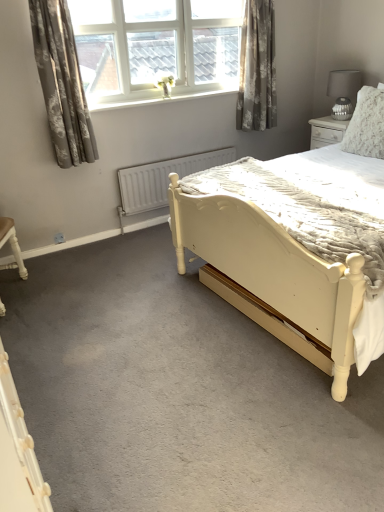
Describe the element at coordinates (156, 46) in the screenshot. I see `white plastic window at upper center` at that location.

Measure the distance between white plastic window at upper center and camera.

white plastic window at upper center and camera are 2.94 meters apart.

Looking at this image, measure the distance between point (235, 90) and camera.

The depth of point (235, 90) is 12.05 feet.

This screenshot has width=384, height=512. What do you see at coordinates (343, 92) in the screenshot?
I see `matte gray lampshade at upper right` at bounding box center [343, 92].

This screenshot has width=384, height=512. Identify the location of matte cream wooden bed at center. (295, 248).

Is matte gray lampshade at upper right thinner than matte cream wooden bed at center?

Indeed, matte gray lampshade at upper right has a lesser width compared to matte cream wooden bed at center.

The width and height of the screenshot is (384, 512). In the image, there is a matte cream wooden bed at center. Identify the location of lamp above it (from the image's perspective). (343, 92).

Which object is positioned more to the right, matte gray lampshade at upper right or matte cream wooden bed at center?

matte gray lampshade at upper right.

From the image's perspective, is matte gray lampshade at upper right below matte cream wooden bed at center?

No.

Can you tell me how much matte gray lampshade at upper right and white glossy window sill at upper center differ in facing direction?

90 degrees.

Considering the sizes of matte gray lampshade at upper right and white glossy window sill at upper center in the image, is matte gray lampshade at upper right taller or shorter than white glossy window sill at upper center?

Clearly, matte gray lampshade at upper right is taller compared to white glossy window sill at upper center.

Does matte gray lampshade at upper right have a lesser width compared to white glossy window sill at upper center?

Incorrect, the width of matte gray lampshade at upper right is not less than that of white glossy window sill at upper center.

The height and width of the screenshot is (512, 384). I want to click on window sill lying in front of the matte gray lampshade at upper right, so click(x=161, y=99).

Based on their sizes in the image, would you say matte gray lampshade at upper right is bigger or smaller than fluffy white pillow at upper right?

In the image, matte gray lampshade at upper right appears to be smaller than fluffy white pillow at upper right.

Are matte gray lampshade at upper right and fluffy white pillow at upper right beside each other?

matte gray lampshade at upper right and fluffy white pillow at upper right are not in contact.

Which of these two, matte gray lampshade at upper right or fluffy white pillow at upper right, is thinner?

With smaller width is fluffy white pillow at upper right.

From the image's perspective, which is above, floral fabric curtain at upper right, positioned as the first curtain in back-to-front order, or white glossy window sill at upper center?

floral fabric curtain at upper right, positioned as the first curtain in back-to-front order, from the image's perspective.

Does floral fabric curtain at upper right, positioned as the first curtain in back-to-front order, come behind white glossy window sill at upper center?

That is True.

Between floral fabric curtain at upper right, placed as the 2th curtain when sorted from left to right, and white glossy window sill at upper center, which one has larger size?

floral fabric curtain at upper right, placed as the 2th curtain when sorted from left to right.

Could you tell me if white plastic window at upper center is facing white glossy window sill at upper center?

No, white plastic window at upper center is not turned towards white glossy window sill at upper center.

Locate an element on the screen. window sill below the white plastic window at upper center (from the image's perspective) is located at coordinates (161, 99).

Do you think white plastic window at upper center is within white glossy window sill at upper center, or outside of it?

white plastic window at upper center cannot be found inside white glossy window sill at upper center.

Which is behind, point (152, 3) or point (127, 106)?

The point (127, 106) is farther from the camera.

Is white glossy window sill at upper center oriented away from matte gray lampshade at upper right?

No, white glossy window sill at upper center is not facing away from matte gray lampshade at upper right.

Can you tell me how much white glossy window sill at upper center and matte gray lampshade at upper right differ in facing direction?

There is a 90-degree angle between the facing directions of white glossy window sill at upper center and matte gray lampshade at upper right.

Considering the relative sizes of white glossy window sill at upper center and matte gray lampshade at upper right in the image provided, is white glossy window sill at upper center smaller than matte gray lampshade at upper right?

Indeed, white glossy window sill at upper center has a smaller size compared to matte gray lampshade at upper right.

Is matte cream wooden bed at center not within floral fabric curtain at upper right, positioned as the first curtain in back-to-front order?

Absolutely, matte cream wooden bed at center is external to floral fabric curtain at upper right, positioned as the first curtain in back-to-front order.

Is matte cream wooden bed at center next to floral fabric curtain at upper right, placed as the 2th curtain when sorted from left to right?

No, matte cream wooden bed at center is not touching floral fabric curtain at upper right, placed as the 2th curtain when sorted from left to right.

Considering the sizes of objects matte cream wooden bed at center and floral fabric curtain at upper right, positioned as the first curtain in back-to-front order, in the image provided, who is taller, matte cream wooden bed at center or floral fabric curtain at upper right, positioned as the first curtain in back-to-front order,?

With more height is matte cream wooden bed at center.

Based on the photo, between matte cream wooden bed at center and floral fabric curtain at upper right, positioned as the first curtain in back-to-front order, which one is positioned in front?

matte cream wooden bed at center is closer to the camera.

Identify the location of bed that appears below the matte gray lampshade at upper right (from the image's perspective). The image size is (384, 512). (295, 248).

Locate an element on the screen. lamp on the right side of white glossy window sill at upper center is located at coordinates (343, 92).

From the picture: When comparing their distances from floral fabric curtain at upper right, the first curtain from the right, does fluffy white pillow at upper right or white glossy window sill at upper center seem closer?

white glossy window sill at upper center.

Based on their spatial positions, is matte gray lampshade at upper right or white plastic window at upper center closer to white glossy window sill at upper center?

white plastic window at upper center.

From the image, which object appears to be farther from matte cream wooden bed at center, white glossy window sill at upper center or floral fabric curtain at upper right, which is the second curtain in front-to-back order?

Among the two, white glossy window sill at upper center is located further to matte cream wooden bed at center.

In the scene shown: Considering their positions, is matte gray lampshade at upper right positioned further to matte cream wooden bed at center than fluffy white pillow at upper right?

Among the two, matte gray lampshade at upper right is located further to matte cream wooden bed at center.

Estimate the real-world distances between objects in this image. Which object is further from floral gray curtain at upper left, positioned as the second curtain in right-to-left order, white matte radiator at center or matte cream wooden bed at center?

matte cream wooden bed at center is positioned further to the anchor floral gray curtain at upper left, positioned as the second curtain in right-to-left order.

Based on their spatial positions, is floral fabric curtain at upper right, placed as the 2th curtain when sorted from left to right, or white matte radiator at center further from matte cream wooden bed at center?

floral fabric curtain at upper right, placed as the 2th curtain when sorted from left to right, is positioned further to the anchor matte cream wooden bed at center.

Which object lies further to the anchor point floral gray curtain at upper left, which appears as the second curtain when viewed from the back, white matte radiator at center or floral fabric curtain at upper right, the first curtain from the right?

floral fabric curtain at upper right, the first curtain from the right, is further to floral gray curtain at upper left, which appears as the second curtain when viewed from the back.

When comparing their distances from white glossy window sill at upper center, does floral gray curtain at upper left, the 1th curtain when ordered from front to back, or matte cream wooden bed at center seem further?

Based on the image, matte cream wooden bed at center appears to be further to white glossy window sill at upper center.

At what (x,y) coordinates should I click in order to perform the action: click on curtain between white glossy window sill at upper center and matte gray lampshade at upper right. Please return your answer as a coordinate pair (x, y). Looking at the image, I should click on (257, 68).

Find the location of `lamp between white matte radiator at center and fluffy white pillow at upper right in the horizontal direction`. lamp between white matte radiator at center and fluffy white pillow at upper right in the horizontal direction is located at coordinates (343, 92).

This screenshot has height=512, width=384. What are the coordinates of `curtain between floral gray curtain at upper left, the 1th curtain when ordered from front to back, and fluffy white pillow at upper right` in the screenshot? It's located at pyautogui.click(x=257, y=68).

This screenshot has width=384, height=512. I want to click on bed between floral gray curtain at upper left, marked as the first curtain in a left-to-right arrangement, and matte gray lampshade at upper right from left to right, so click(295, 248).